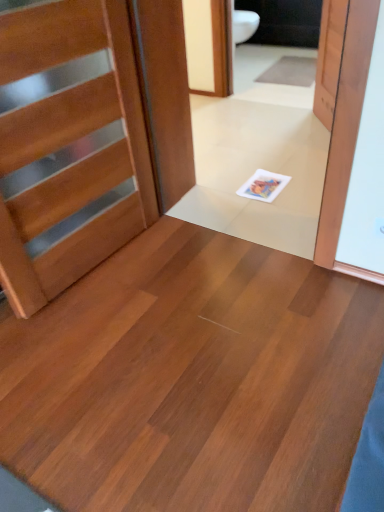
The height and width of the screenshot is (512, 384). I want to click on vacant area that is situated to the right of wooden door at left, placed as the first door when sorted from front to back, so click(x=187, y=272).